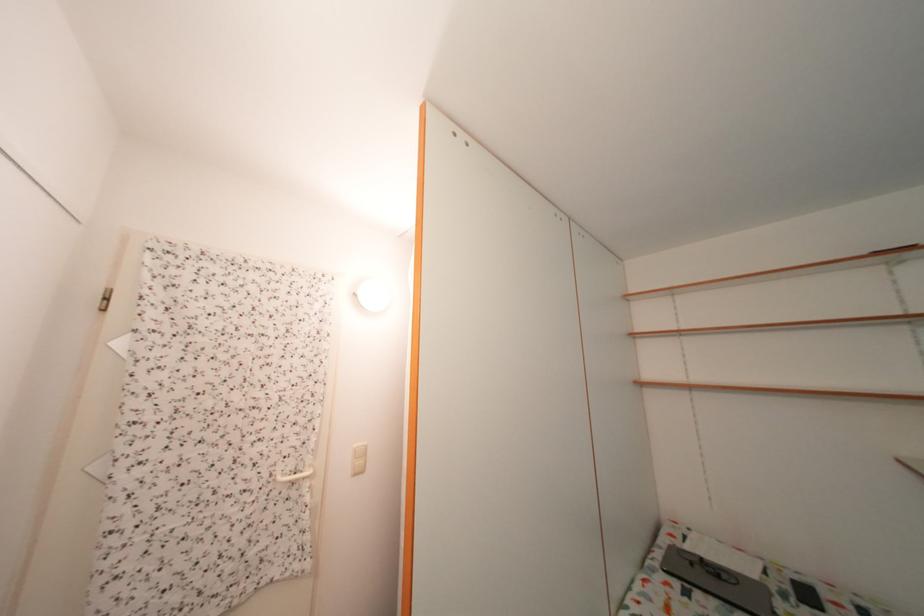
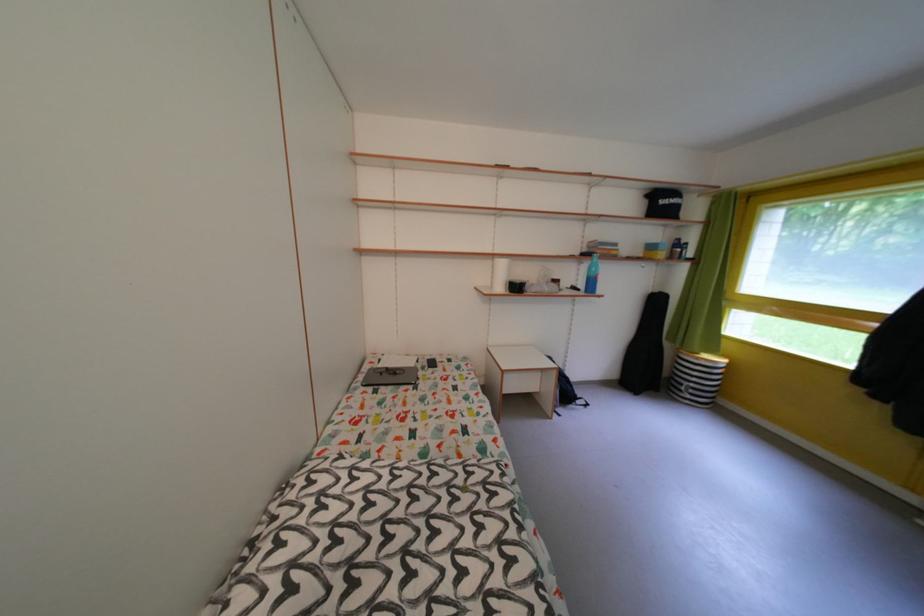
The point at [774,578] is marked in the first image. Where is the corresponding point in the second image?

(428, 368)